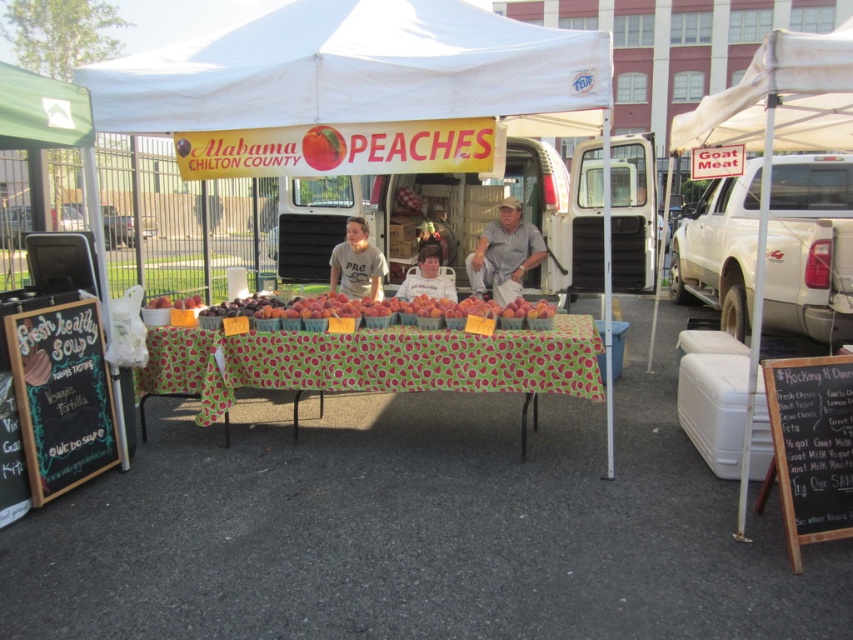
Question: Which of the following is the closest to the observer?

Choices:
 (A) white fabric tent at right
 (B) black chalkboard at left
 (C) white fabric shirt at center

Answer: (A)

Question: Observing the image, what is the correct spatial positioning of green fabric tablecloth at center in reference to smooth peach at center?

Choices:
 (A) below
 (B) above

Answer: (A)

Question: Among these points, which one is nearest to the camera?

Choices:
 (A) (363, 259)
 (B) (680, 129)
 (C) (469, 344)

Answer: (C)

Question: Based on their relative distances, which object is nearer to the white fabric tent at center?

Choices:
 (A) gray cotton shirt at center
 (B) green fabric tablecloth at center
 (C) black chalkboard menu at lower right

Answer: (B)

Question: Can you confirm if gray striped shirt at center is bigger than white fabric shirt at center?

Choices:
 (A) yes
 (B) no

Answer: (A)

Question: Is white fabric tent at right below white fabric canopy at upper right?

Choices:
 (A) yes
 (B) no

Answer: (A)